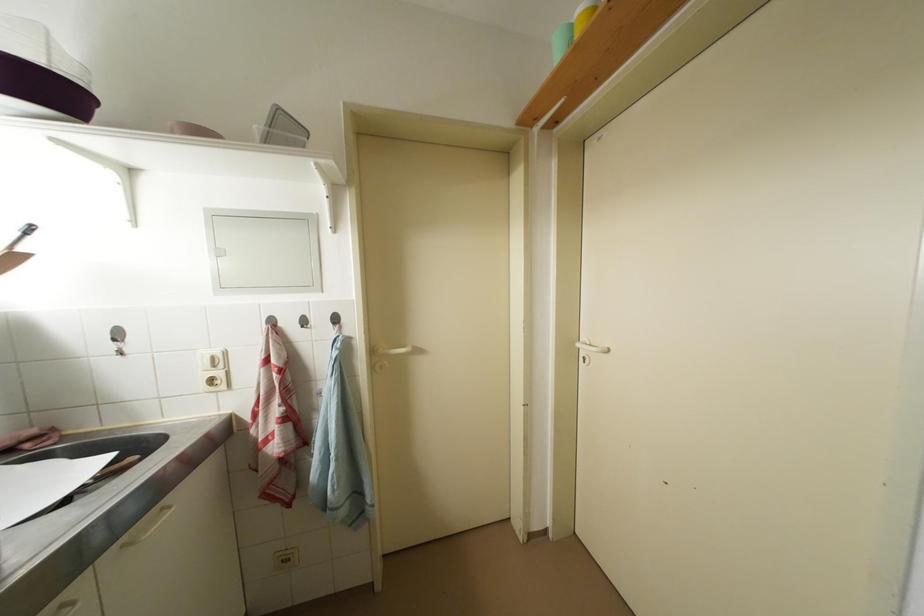
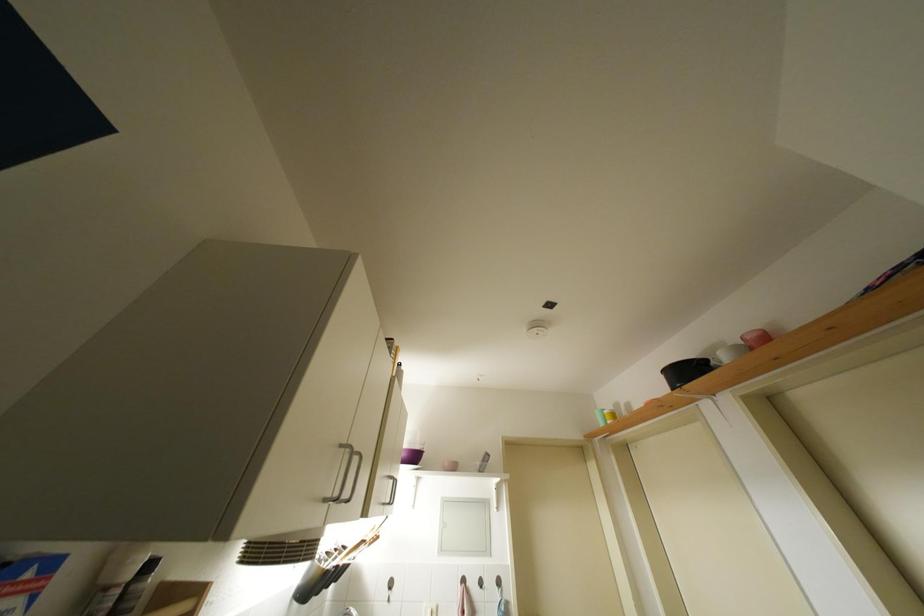
In the second image, find the point that corresponds to the point at 228,292 in the first image.

(447, 554)